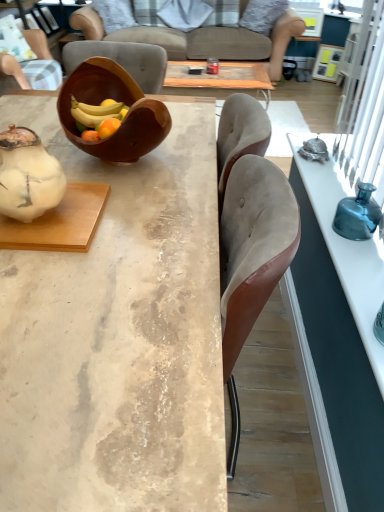
Question: From the image's perspective, is white fabric pillow at upper center, acting as the 2th pillow starting from the right, below white matte teapot at left?

Choices:
 (A) yes
 (B) no

Answer: (B)

Question: Does white fabric pillow at upper center, positioned as the first pillow in left-to-right order, lie behind white matte teapot at left?

Choices:
 (A) yes
 (B) no

Answer: (A)

Question: Is white fabric pillow at upper center, acting as the 2th pillow starting from the right, at the right side of white matte teapot at left?

Choices:
 (A) yes
 (B) no

Answer: (A)

Question: Is white fabric pillow at upper center, acting as the 2th pillow starting from the right, placed right next to white matte teapot at left?

Choices:
 (A) yes
 (B) no

Answer: (B)

Question: Does white fabric pillow at upper center, positioned as the first pillow in left-to-right order, have a smaller size compared to white matte teapot at left?

Choices:
 (A) no
 (B) yes

Answer: (A)

Question: Is white fabric pillow at upper center, acting as the 2th pillow starting from the right, positioned in front of white matte teapot at left?

Choices:
 (A) yes
 (B) no

Answer: (B)

Question: Considering the relative sizes of teal glass vase at right, the 2th desk from the left, and matte wood cabinet at upper left in the image provided, is teal glass vase at right, the 2th desk from the left, wider than matte wood cabinet at upper left?

Choices:
 (A) no
 (B) yes

Answer: (A)

Question: Is teal glass vase at right, the 2th desk from the left, turned away from matte wood cabinet at upper left?

Choices:
 (A) no
 (B) yes

Answer: (A)

Question: Can you confirm if teal glass vase at right, the 2th desk from the left, is shorter than matte wood cabinet at upper left?

Choices:
 (A) yes
 (B) no

Answer: (A)

Question: From a real-world perspective, is teal glass vase at right, acting as the 1th desk starting from the right, physically below matte wood cabinet at upper left?

Choices:
 (A) yes
 (B) no

Answer: (B)

Question: Could you tell me if teal glass vase at right, the 2th desk from the left, is turned towards matte wood cabinet at upper left?

Choices:
 (A) yes
 (B) no

Answer: (B)

Question: From the image's perspective, is teal glass vase at right, acting as the 1th desk starting from the right, located above matte wood cabinet at upper left?

Choices:
 (A) yes
 (B) no

Answer: (B)

Question: Would you say fluffy gray pillow at upper center, which is the 2th pillow in left-to-right order, is part of brown wooden bowl at center's contents?

Choices:
 (A) yes
 (B) no

Answer: (B)